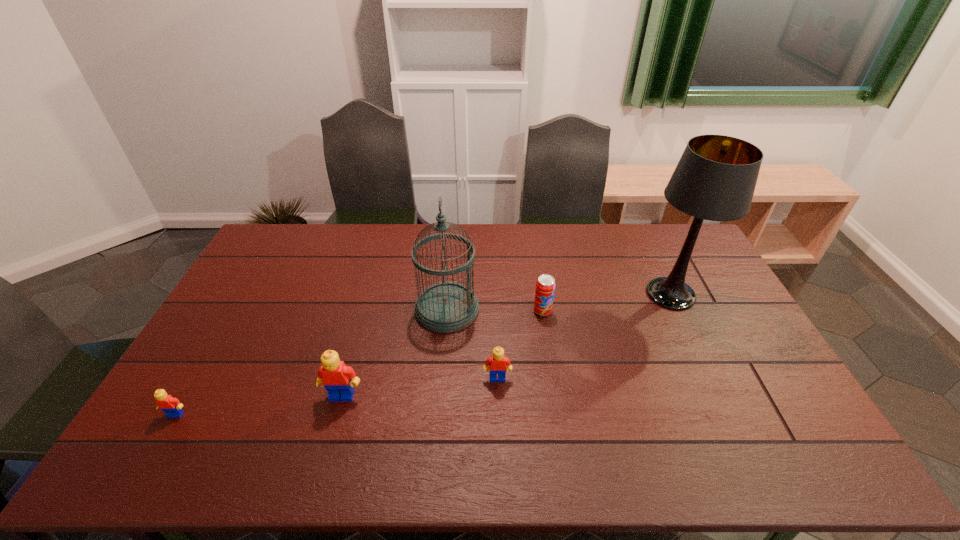
Locate an element on the screen. the shortest Lego is located at coordinates (171, 406).

This screenshot has height=540, width=960. In order to click on the leftmost object in this screenshot , I will do `click(171, 406)`.

At what (x,y) coordinates should I click in order to perform the action: click on the fifth object from right to left. Please return your answer as a coordinate pair (x, y). Looking at the image, I should click on (x=338, y=379).

Locate an element on the screen. the second Lego from left to right is located at coordinates (338, 379).

The height and width of the screenshot is (540, 960). Identify the location of the farthest Lego. (497, 363).

What are the coordinates of `the rightmost Lego` in the screenshot? It's located at (497, 363).

The image size is (960, 540). What are the coordinates of `the rightmost object` in the screenshot? It's located at (715, 179).

Find the location of `table lamp`. table lamp is located at coordinates (715, 179).

Image resolution: width=960 pixels, height=540 pixels. I want to click on birdcage, so click(x=445, y=307).

Where is `the fifth shortest object`? The height and width of the screenshot is (540, 960). the fifth shortest object is located at coordinates (445, 307).